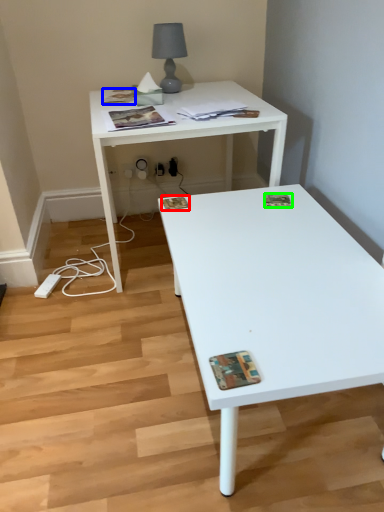
Question: Which is nearer to the magazine (highlighted by a red box)? magazine (highlighted by a blue box) or magazine (highlighted by a green box).

Choices:
 (A) magazine
 (B) magazine

Answer: (B)